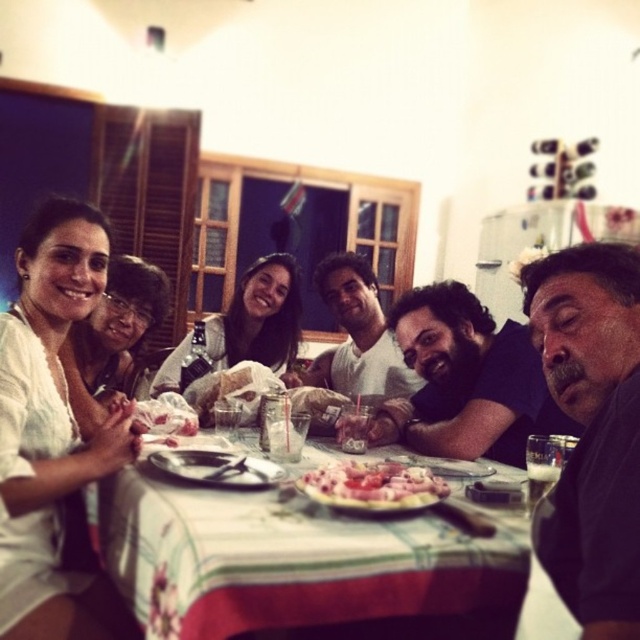
Question: Estimate the real-world distances between objects in this image. Which object is closer to the dark gray shirt at right?

Choices:
 (A) white printed tablecloth at center
 (B) white cotton shirt at upper left

Answer: (A)

Question: Which object appears closest to the camera in this image?

Choices:
 (A) smooth white shirt at center
 (B) pinkish glossy meat at center
 (C) dark brown hair at center

Answer: (B)

Question: Is white printed tablecloth at center thinner than smooth white shirt at center?

Choices:
 (A) no
 (B) yes

Answer: (A)

Question: Which point is closer to the camera?

Choices:
 (A) white printed tablecloth at center
 (B) pinkish glossy meat at center
 (C) dark brown hair at center
 (D) dark gray shirt at right

Answer: (D)

Question: Can you confirm if dark gray shirt at right is thinner than dark brown hair at center?

Choices:
 (A) yes
 (B) no

Answer: (A)

Question: Does smooth white shirt at center appear under pinkish glossy meat at center?

Choices:
 (A) no
 (B) yes

Answer: (A)